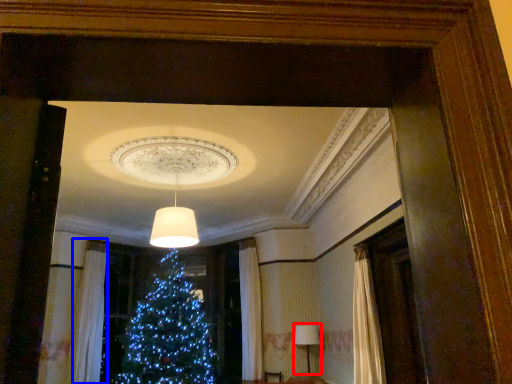
Question: Among these objects, which one is nearest to the camera, lamp (highlighted by a red box) or curtain (highlighted by a blue box)?

Choices:
 (A) lamp
 (B) curtain

Answer: (A)